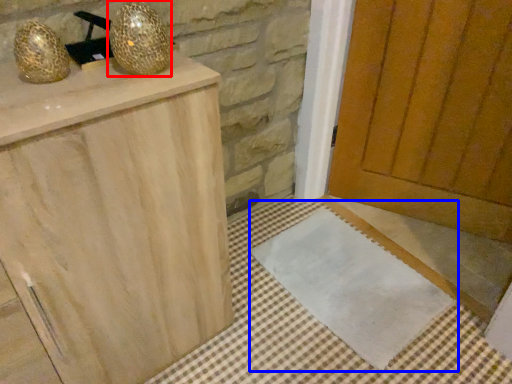
Question: Which object is further to the camera taking this photo, disco ball (highlighted by a red box) or doormat (highlighted by a blue box)?

Choices:
 (A) disco ball
 (B) doormat

Answer: (B)